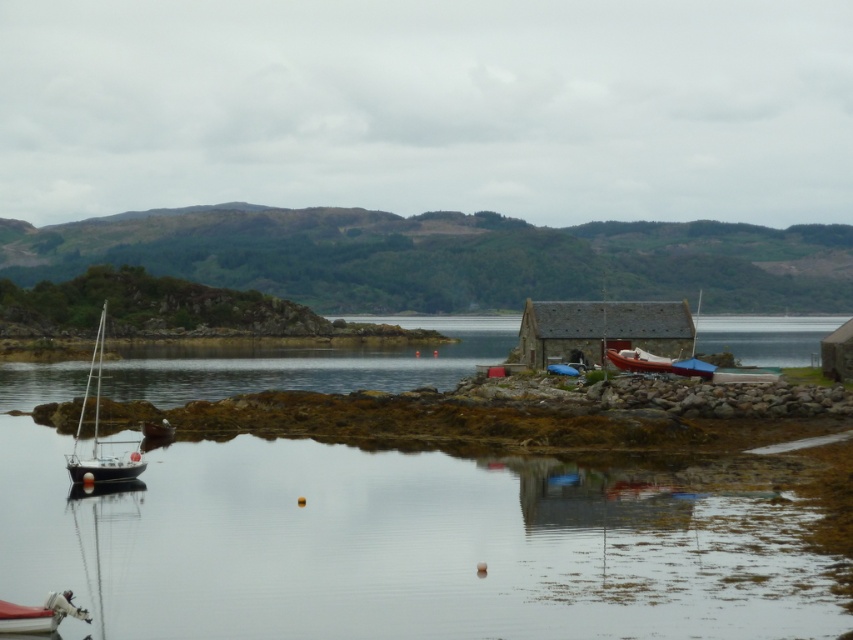
Question: Is clear water at lower left above wooden boat at right?

Choices:
 (A) no
 (B) yes

Answer: (A)

Question: Which object is the farthest from the wooden boat at right?

Choices:
 (A) white glossy sailboat at left
 (B) white plastic boat at lower left

Answer: (B)

Question: Estimate the real-world distances between objects in this image. Which object is farther from the wooden boat at right?

Choices:
 (A) white glossy sailboat at left
 (B) clear water at lower left
 (C) white plastic boat at lower left

Answer: (C)

Question: Does clear water at lower left lie behind wooden boat at right?

Choices:
 (A) no
 (B) yes

Answer: (A)

Question: Which object is the closest to the white glossy sailboat at left?

Choices:
 (A) white plastic boat at lower left
 (B) clear water at lower left
 (C) wooden boat at right

Answer: (B)

Question: Can you confirm if white glossy sailboat at left is thinner than white plastic boat at lower left?

Choices:
 (A) no
 (B) yes

Answer: (A)